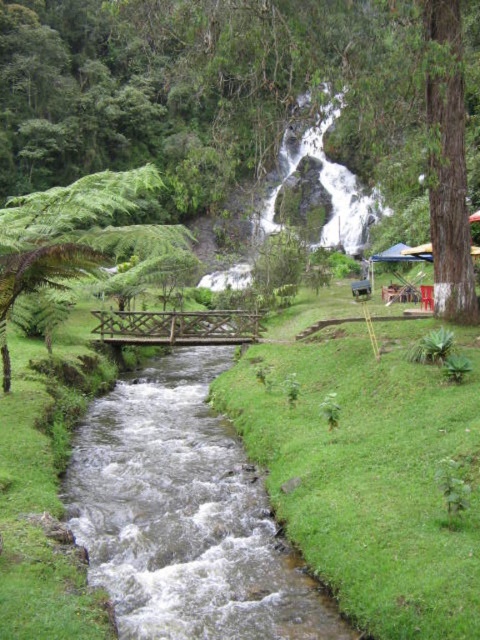
Can you confirm if green grass at center is taller than clear water stream at center?

Yes, green grass at center is taller than clear water stream at center.

Which is more to the left, green grass at center or clear water stream at center?

From the viewer's perspective, clear water stream at center appears more on the left side.

The height and width of the screenshot is (640, 480). In order to click on green grass at center in this screenshot , I will do `click(369, 472)`.

Locate an element on the screen. The width and height of the screenshot is (480, 640). green grass at center is located at coordinates (369, 472).

Who is lower down, green grass at center or green leafy tree at left?

green grass at center is lower down.

Locate an element on the screen. The image size is (480, 640). green grass at center is located at coordinates (369, 472).

Who is taller, clear water stream at center or green leafy tree at left?

green leafy tree at left is taller.

Which is behind, point (136, 577) or point (0, 230)?

The point (0, 230) is more distant.

This screenshot has width=480, height=640. What are the coordinates of `clear water stream at center` in the screenshot? It's located at [184, 515].